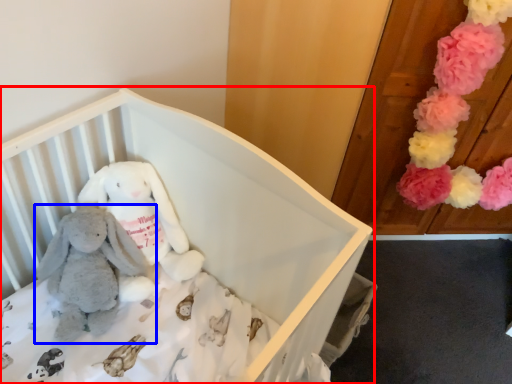
Question: Which of the following is the farthest to the observer, infant bed (highlighted by a red box) or toy (highlighted by a blue box)?

Choices:
 (A) infant bed
 (B) toy

Answer: (B)